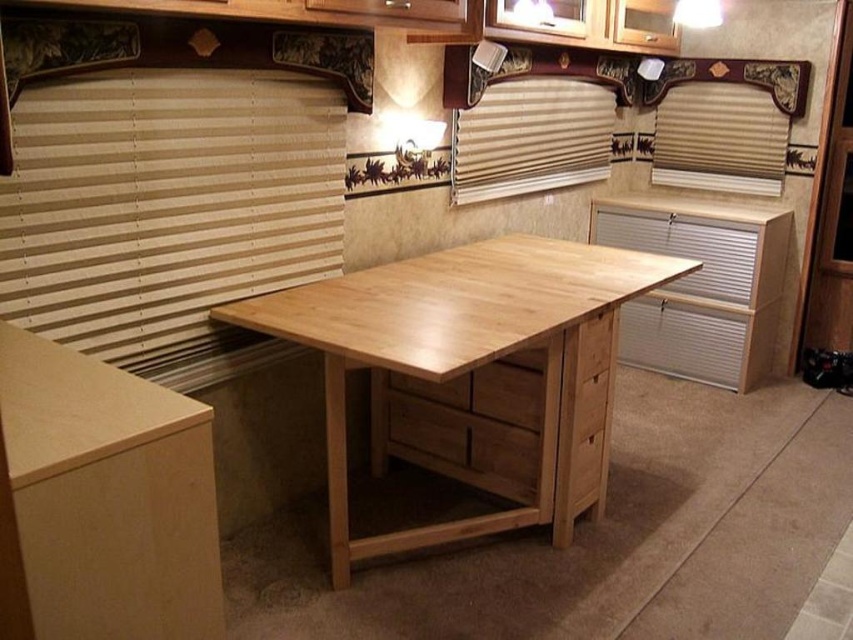
Question: Is wooden blinds at left positioned at the back of beige wood blinds at upper right?

Choices:
 (A) yes
 (B) no

Answer: (B)

Question: Which object is positioned closest to the beige wood blinds at upper center?

Choices:
 (A) wooden blinds at left
 (B) beige wood blinds at upper right

Answer: (B)

Question: Estimate the real-world distances between objects in this image. Which object is closer to the natural wood table at center?

Choices:
 (A) beige wood blinds at upper right
 (B) beige wood blinds at upper center
 (C) wooden blinds at left

Answer: (C)

Question: Does natural wood table at center have a smaller size compared to beige wood blinds at upper center?

Choices:
 (A) no
 (B) yes

Answer: (A)

Question: Among these objects, which one is nearest to the camera?

Choices:
 (A) wooden blinds at left
 (B) natural wood table at center
 (C) beige wood blinds at upper center
 (D) beige wood blinds at upper right

Answer: (A)

Question: Is the position of wooden blinds at left less distant than that of natural wood table at center?

Choices:
 (A) no
 (B) yes

Answer: (B)